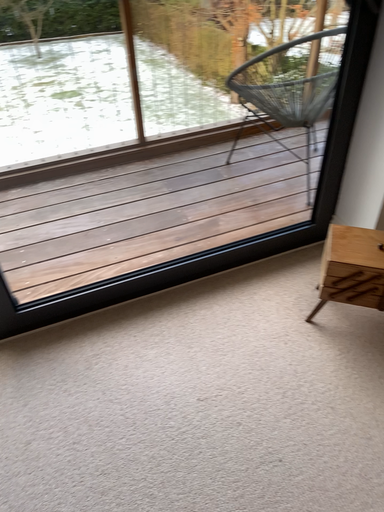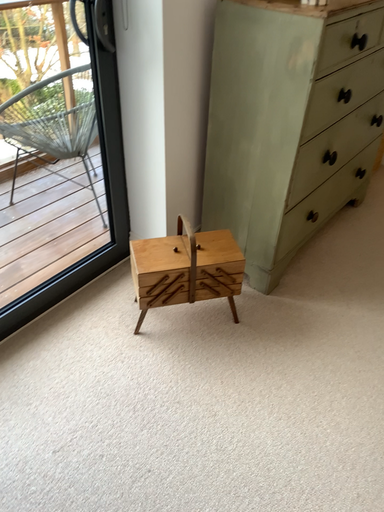
Question: Which way did the camera rotate in the video?

Choices:
 (A) rotated right
 (B) rotated left

Answer: (A)